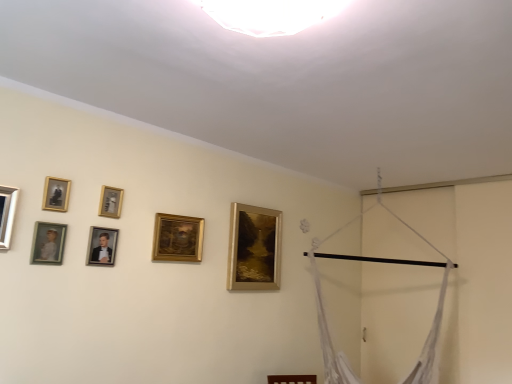
Question: Considering the relative positions of gold metallic picture frame at upper center, marked as the fifth picture frame in a front-to-back arrangement, and matte gold picture frame at left, the 6th picture frame in the right-to-left sequence, in the image provided, is gold metallic picture frame at upper center, marked as the fifth picture frame in a front-to-back arrangement, to the left or to the right of matte gold picture frame at left, the 6th picture frame in the right-to-left sequence,?

Choices:
 (A) right
 (B) left

Answer: (A)

Question: From the image's perspective, is gold metallic picture frame at upper center, the 3th picture frame viewed from the right, above or below matte gold picture frame at left, the 6th picture frame in the right-to-left sequence?

Choices:
 (A) above
 (B) below

Answer: (A)

Question: Considering the real-world distances, which object is farthest from the gold metallic picture frame at center, which is the 6th picture frame from left to right?

Choices:
 (A) matte gold picture frame at left, which is the second picture frame in left-to-right order
 (B) gold/golden frame at upper center, which appears as the first picture frame when viewed from the right
 (C) matte black picture frame at center left, which ranks as the 4th picture frame in right-to-left order
 (D) matte silver picture frame at left, placed as the seventh picture frame when sorted from right to left
 (E) gold-framed portrait at upper left, marked as the 5th picture frame in a right-to-left arrangement

Answer: (D)

Question: Estimate the real-world distances between objects in this image. Which object is farther from the gold metallic picture frame at upper center, marked as the fifth picture frame in a front-to-back arrangement?

Choices:
 (A) matte silver picture frame at left, which is the 7th picture frame in back-to-front order
 (B) gold-framed portrait at upper left, acting as the fifth picture frame starting from the back
 (C) matte gold picture frame at left, which is the second picture frame in left-to-right order
 (D) matte black picture frame at center left, the fourth picture frame viewed from the front
 (E) gold metallic picture frame at center, which appears as the second picture frame when viewed from the right

Answer: (A)